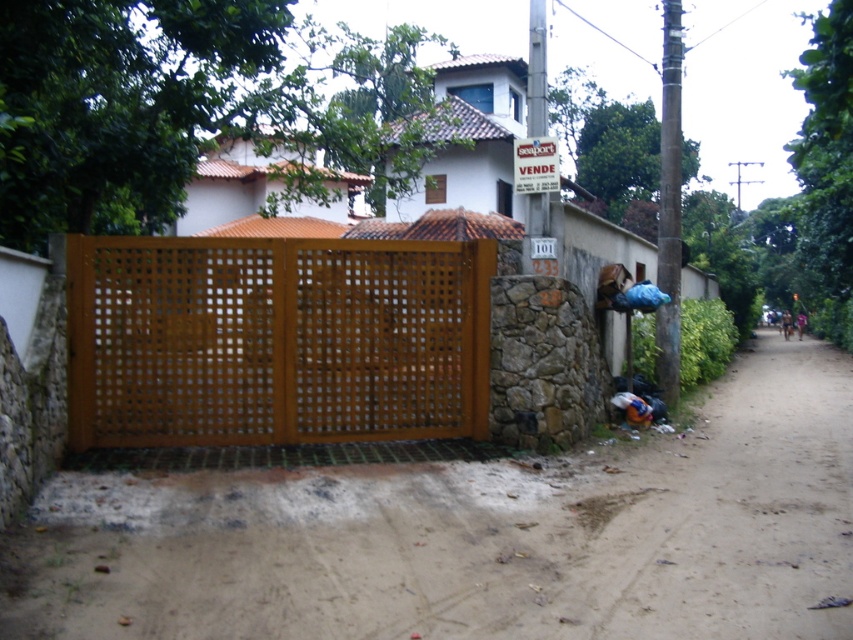
You are a delivery driver approaching the property and need to turn left onto a path. The brown sandy dirt track at lower center and the brown wooden fence at center are in your way. Which one should you drive over to make the turn?

The brown sandy dirt track at lower center is bigger than the brown wooden fence at center, so you should drive over the brown sandy dirt track at lower center to make the turn.

You are a delivery driver approaching the property and need to turn your truck around. The truck requires a minimum turning radius of 12 feet. Based on the scene, can you determine if the brown sandy dirt track at lower center is wide enough for your truck to maneuver compared to the brown wooden fence at center?

The brown sandy dirt track at lower center is wider than the brown wooden fence at center. Since the track is wider, it likely provides sufficient space for the truck to turn around with its required 12 feet turning radius.